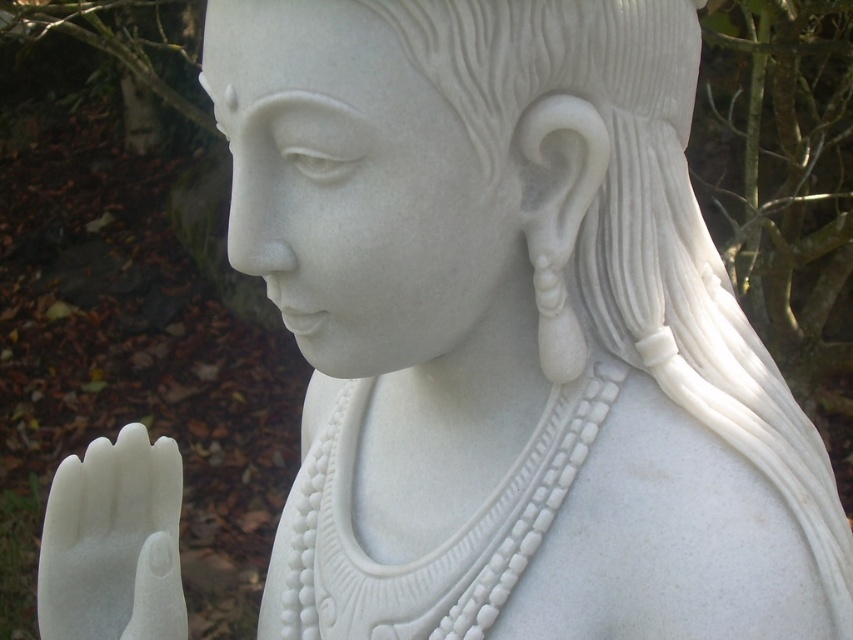
Consider the image. Can you confirm if white marble statue at center is positioned to the right of white marble hand at lower left?

Yes, white marble statue at center is to the right of white marble hand at lower left.

The width and height of the screenshot is (853, 640). What do you see at coordinates (599, 160) in the screenshot?
I see `white marble statue at center` at bounding box center [599, 160].

At what (x,y) coordinates should I click in order to perform the action: click on white marble statue at center. Please return your answer as a coordinate pair (x, y). The image size is (853, 640). Looking at the image, I should click on (599, 160).